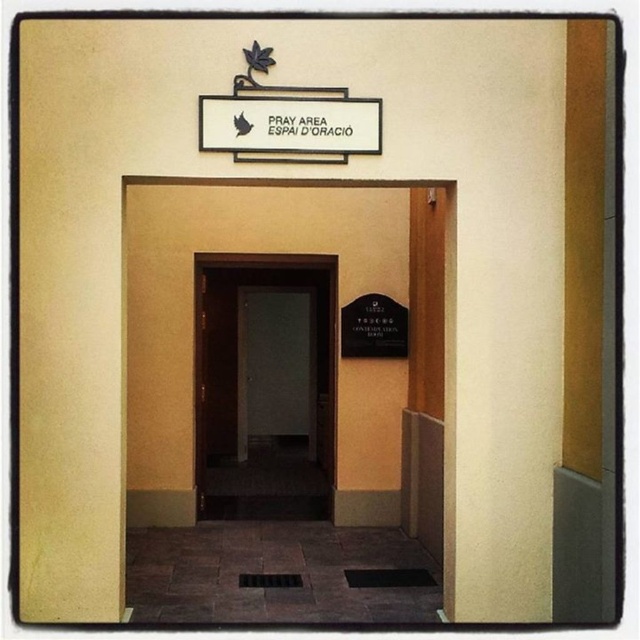
You are standing in front of the entrance to the prayer area. You need to enter through the wooden door at center. Can you walk directly towards the door without moving sideways, considering the position of the white plastic sign at upper center?

Yes, you can walk directly towards the wooden door at center without moving sideways because it is closer to you than the white plastic sign at upper center, so there is no obstruction in your path.

You are standing at the entrance of the PRAY AREA and want to place a small potted plant. You have two points marked on the floor where you can place it. The first point is at coordinate point (x=324, y=387) and the second is at point (x=257, y=157). Which point is closer to you so the plant is more visible?

Point (x=324, y=387) is further to the viewer than point (x=257, y=157). Therefore, placing the plant at point (x=324, y=387) will make it more visible since it is closer to you.